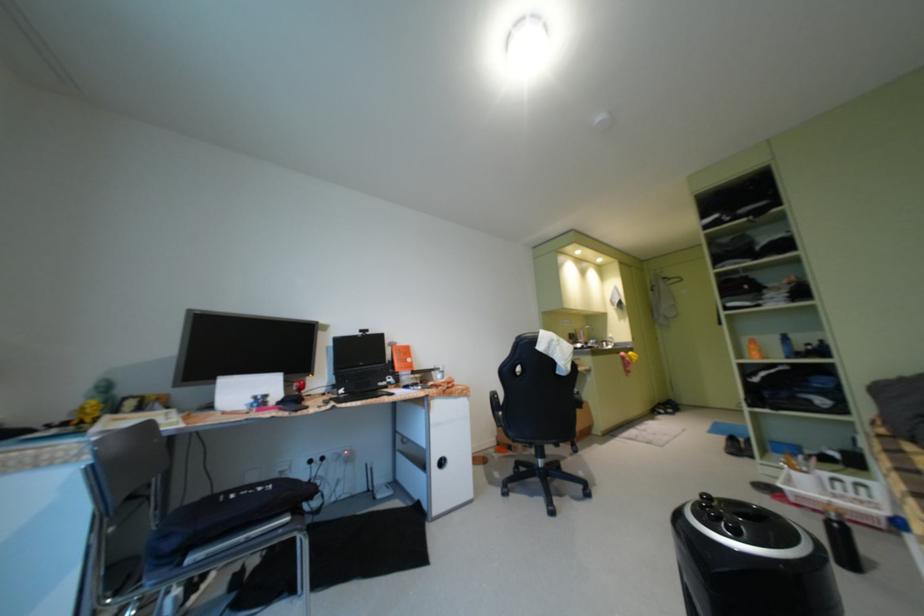
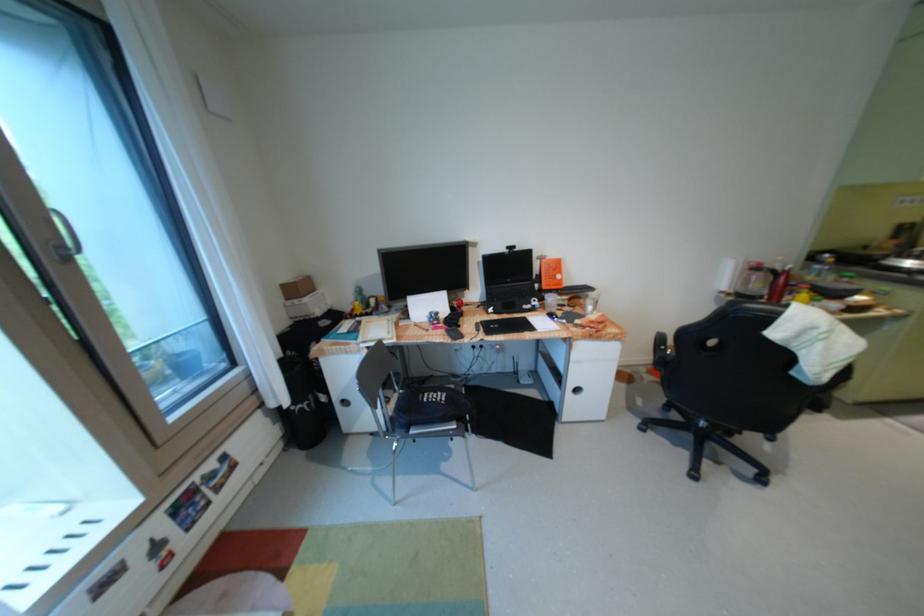
In the second image, find the point that corresponds to (x=408, y=363) in the first image.

(555, 280)